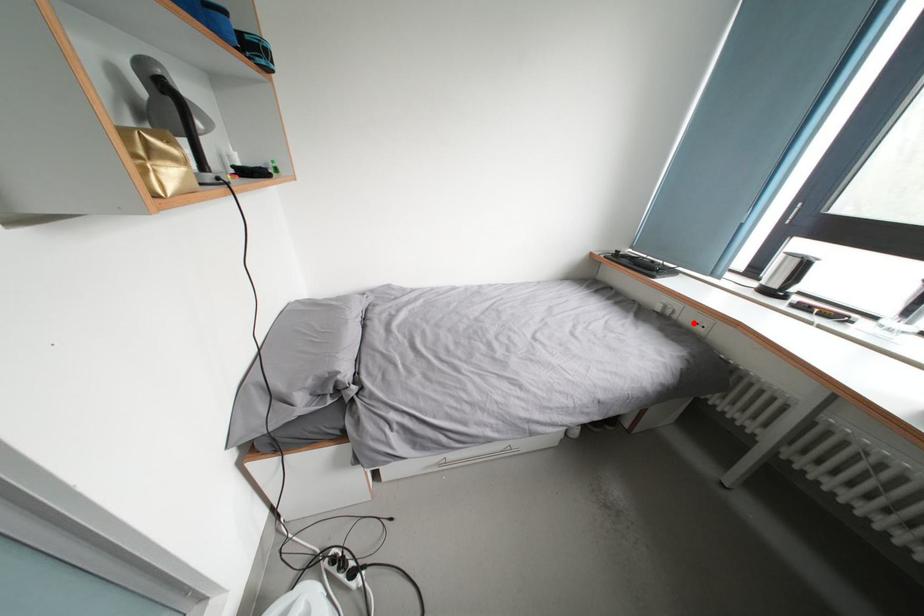
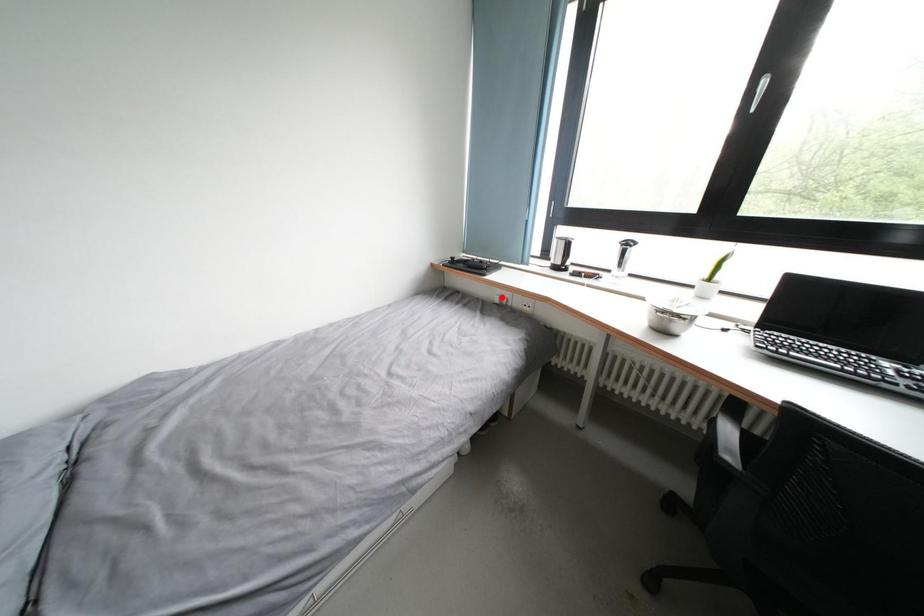
I am providing you with two images of the same scene from different viewpoints. A red point is marked on the first image and another point is marked on the second image. Do the highlighted points in image1 and image2 indicate the same real-world spot?

No